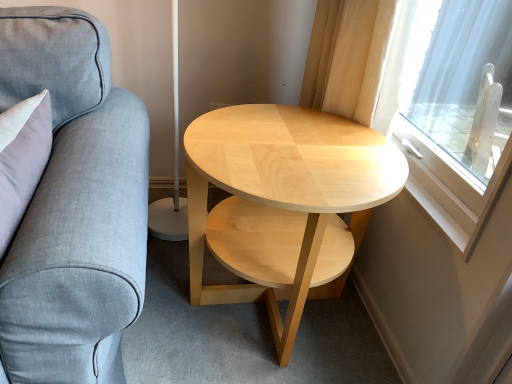
Question: Does transparent glass window at right come in front of gray fabric couch at left?

Choices:
 (A) no
 (B) yes

Answer: (A)

Question: From the image's perspective, does transparent glass window at right appear higher than gray fabric couch at left?

Choices:
 (A) no
 (B) yes

Answer: (B)

Question: From a real-world perspective, is transparent glass window at right located higher than gray fabric couch at left?

Choices:
 (A) no
 (B) yes

Answer: (B)

Question: Is transparent glass window at right positioned far away from gray fabric couch at left?

Choices:
 (A) yes
 (B) no

Answer: (B)

Question: From a real-world perspective, is transparent glass window at right physically below gray fabric couch at left?

Choices:
 (A) yes
 (B) no

Answer: (B)

Question: Considering their positions, is transparent glass window at right located in front of or behind natural wood coffee table at center?

Choices:
 (A) behind
 (B) front

Answer: (B)

Question: From a real-world perspective, relative to natural wood coffee table at center, is transparent glass window at right vertically above or below?

Choices:
 (A) below
 (B) above

Answer: (B)

Question: Based on their sizes in the image, would you say transparent glass window at right is bigger or smaller than natural wood coffee table at center?

Choices:
 (A) big
 (B) small

Answer: (B)

Question: Is transparent glass window at right situated inside natural wood coffee table at center or outside?

Choices:
 (A) outside
 (B) inside

Answer: (A)

Question: Visually, is gray fabric couch at left positioned to the left or to the right of transparent glass window at right?

Choices:
 (A) right
 (B) left

Answer: (B)

Question: Is gray fabric couch at left inside or outside of transparent glass window at right?

Choices:
 (A) outside
 (B) inside

Answer: (A)

Question: Considering the positions of gray fabric couch at left and transparent glass window at right in the image, is gray fabric couch at left bigger or smaller than transparent glass window at right?

Choices:
 (A) big
 (B) small

Answer: (A)

Question: From a real-world perspective, relative to transparent glass window at right, is gray fabric couch at left vertically above or below?

Choices:
 (A) above
 (B) below

Answer: (B)

Question: In terms of width, does natural wood coffee table at center look wider or thinner when compared to transparent glass window at right?

Choices:
 (A) thin
 (B) wide

Answer: (B)

Question: Is point (252, 168) closer or farther from the camera than point (379, 44)?

Choices:
 (A) farther
 (B) closer

Answer: (B)